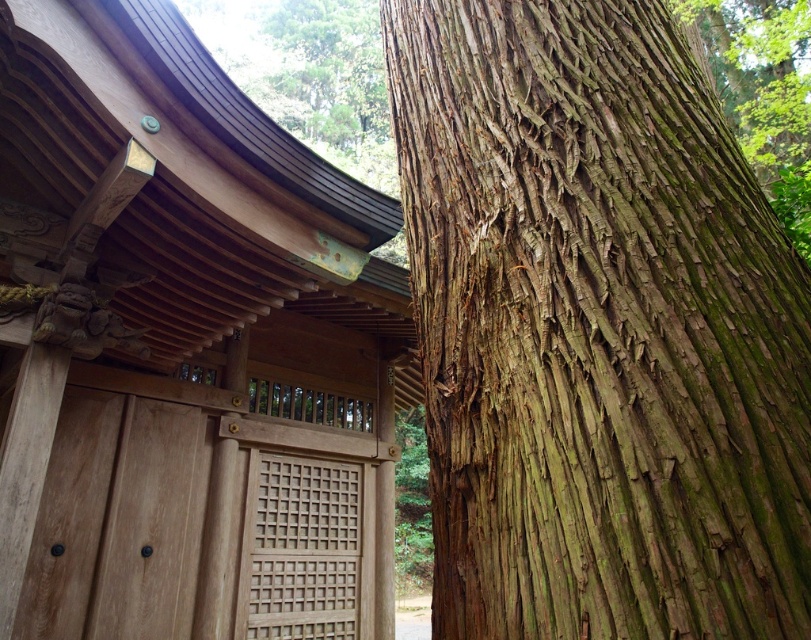
You are standing in front of the wooden lattice door at center and want to take a photo of the green rough bark tree at upper center. Which direction should you move to get the tree in your camera view?

You should move to the left to get the green rough bark tree at upper center in your camera view because the wooden lattice door at center is to the right of the tree.

You are a visitor at the shrine and want to enter through the wooden lattice door at center. However, you notice the green rough bark tree at upper center nearby. Considering their sizes, which one do you think is bigger?

The green rough bark tree at upper center is bigger than the wooden lattice door at center.

You are a visitor standing at the entrance of the shrine. You notice the wooden at left and the green rough bark tree at upper center. Which object is closer to the entrance?

The wooden at left is closer to the entrance because it is positioned under the green rough bark tree at upper center, indicating it is in front.